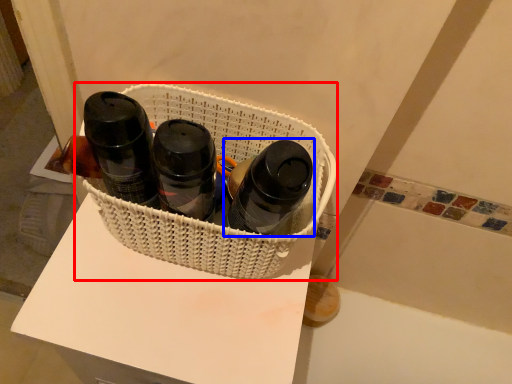
Question: Which object appears closest to the camera in this image, basket (highlighted by a red box) or bottle (highlighted by a blue box)?

Choices:
 (A) basket
 (B) bottle

Answer: (B)